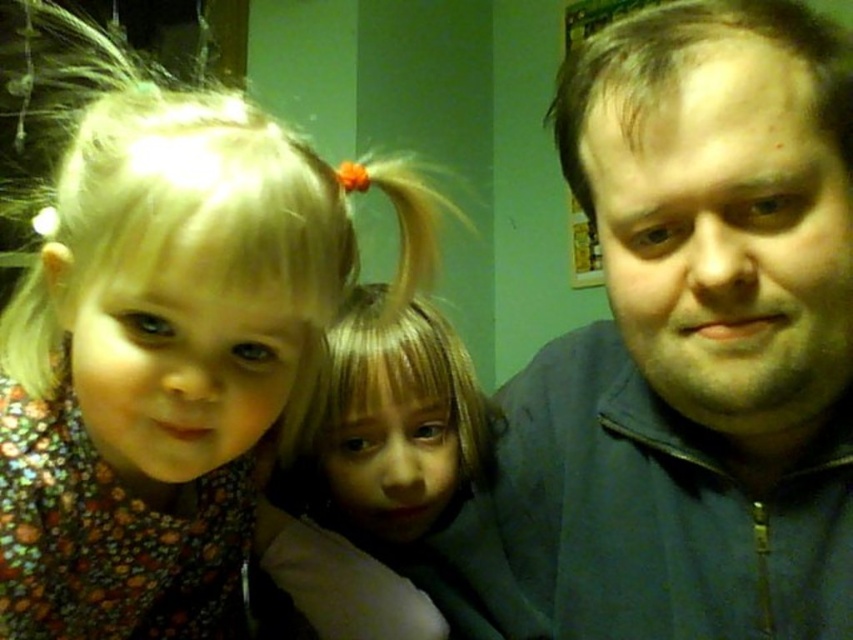
Is blue zip-up jacket at center shorter than blonde hair at center?

No.

Which of these two, blue zip-up jacket at center or blonde hair at center, stands shorter?

Standing shorter between the two is blonde hair at center.

Who is more forward, (675, 83) or (469, 362)?

Point (675, 83) is in front.

Locate an element on the screen. The width and height of the screenshot is (853, 640). blue zip-up jacket at center is located at coordinates (695, 339).

Between blue zip-up jacket at center and blonde hair at left, which one has more height?

With more height is blonde hair at left.

Is blue zip-up jacket at center closer to camera compared to blonde hair at left?

Yes, it is in front of blonde hair at left.

Who is more distant from viewer, (x=607, y=541) or (x=15, y=490)?

Positioned behind is point (x=607, y=541).

The image size is (853, 640). In order to click on blue zip-up jacket at center in this screenshot , I will do `click(695, 339)`.

Can you confirm if blonde hair at left is positioned to the right of blonde hair at center?

Incorrect, blonde hair at left is not on the right side of blonde hair at center.

Is point (126, 317) in front of point (463, 625)?

Yes.

Who is more forward, [161,618] or [426,486]?

Point [161,618]

Image resolution: width=853 pixels, height=640 pixels. In order to click on blonde hair at left in this screenshot , I will do `click(157, 353)`.